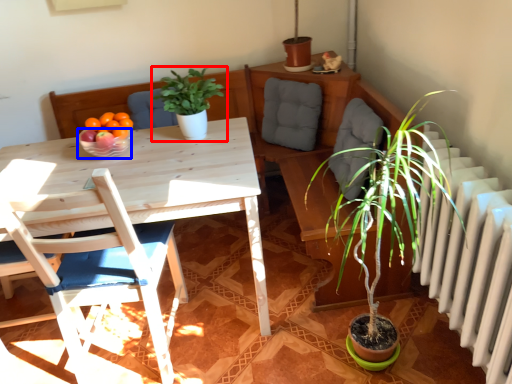
Question: Among these objects, which one is farthest to the camera, houseplant (highlighted by a red box) or bowl (highlighted by a blue box)?

Choices:
 (A) houseplant
 (B) bowl

Answer: (B)